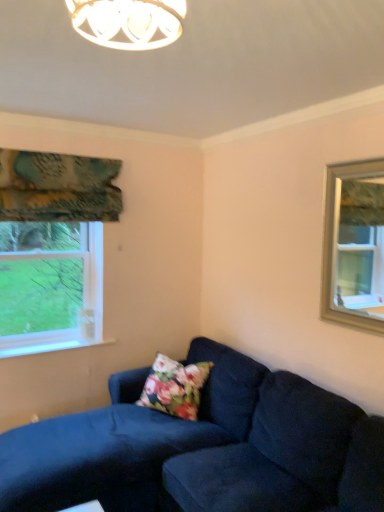
This screenshot has width=384, height=512. What do you see at coordinates (58, 187) in the screenshot?
I see `teal floral fabric at upper left` at bounding box center [58, 187].

Describe the element at coordinates (175, 387) in the screenshot. The image size is (384, 512). I see `floral fabric pillow at lower center` at that location.

Describe the element at coordinates (354, 245) in the screenshot. I see `clear glass window at upper right` at that location.

Identify the location of teal floral fabric at upper left. (58, 187).

Is teal floral fabric at upper left surrounding clear glass window at upper right?

No, teal floral fabric at upper left does not contain clear glass window at upper right.

Is teal floral fabric at upper left facing towards clear glass window at upper right?

No.

Between teal floral fabric at upper left and clear glass window at upper right, which one has larger width?

Wider between the two is teal floral fabric at upper left.

In the scene shown: Is floral fabric pillow at lower center facing away from clear glass window at upper right?

No, clear glass window at upper right is not at the back of floral fabric pillow at lower center.

Is point (159, 381) positioned after point (334, 244)?

That is True.

Between floral fabric pillow at lower center and clear glass window at upper right, which one is positioned in front?

clear glass window at upper right.

Looking at this image, do you think floral fabric pillow at lower center is within clear glass window at upper right, or outside of it?

floral fabric pillow at lower center cannot be found inside clear glass window at upper right.

What's the angular difference between clear glass window at upper right and teal floral fabric at upper left's facing directions?

89.4 degrees separate the facing orientations of clear glass window at upper right and teal floral fabric at upper left.

Considering the sizes of objects clear glass window at upper right and teal floral fabric at upper left in the image provided, who is bigger, clear glass window at upper right or teal floral fabric at upper left?

With larger size is teal floral fabric at upper left.

The image size is (384, 512). Identify the location of curtain to the left of clear glass window at upper right. (58, 187).

From a real-world perspective, is floral fabric pillow at lower center above or below teal floral fabric at upper left?

In terms of real-world spatial position, floral fabric pillow at lower center is below teal floral fabric at upper left.

Considering the sizes of floral fabric pillow at lower center and teal floral fabric at upper left in the image, is floral fabric pillow at lower center bigger or smaller than teal floral fabric at upper left?

Clearly, floral fabric pillow at lower center is larger in size than teal floral fabric at upper left.

Who is taller, floral fabric pillow at lower center or teal floral fabric at upper left?

With more height is floral fabric pillow at lower center.

How different are the orientations of suede dark blue couch at lower right and floral fabric pillow at lower center in degrees?

35.1 degrees.

Relative to floral fabric pillow at lower center, is suede dark blue couch at lower right in front or behind?

In the image, suede dark blue couch at lower right appears in front of floral fabric pillow at lower center.

From a real-world perspective, which is physically below, suede dark blue couch at lower right or floral fabric pillow at lower center?

From a 3D spatial view, suede dark blue couch at lower right is below.

Between point (308, 393) and point (193, 410), which one is positioned behind?

Point (193, 410)

Would you consider teal floral fabric at upper left to be distant from floral fabric pillow at lower center?

Yes, teal floral fabric at upper left is far from floral fabric pillow at lower center.

Is teal floral fabric at upper left turned away from floral fabric pillow at lower center?

No, teal floral fabric at upper left is not facing the opposite direction of floral fabric pillow at lower center.

Based on the photo, between teal floral fabric at upper left and floral fabric pillow at lower center, which one is positioned in front?

Positioned in front is teal floral fabric at upper left.

Is teal floral fabric at upper left at the back of suede dark blue couch at lower right?

No, suede dark blue couch at lower right is not facing away from teal floral fabric at upper left.

Which object is closer to the camera taking this photo, suede dark blue couch at lower right or teal floral fabric at upper left?

Positioned in front is suede dark blue couch at lower right.

Is point (255, 468) closer to camera compared to point (32, 182)?

Yes, point (255, 468) is closer to viewer.

Does suede dark blue couch at lower right have a lesser width compared to teal floral fabric at upper left?

No.

Find the location of a particular element. curtain located above the clear glass window at upper right (from a real-world perspective) is located at coordinates (58, 187).

In order to click on pillow lying on the left of clear glass window at upper right in this screenshot , I will do `click(175, 387)`.

Considering their positions, is clear glass window at upper right positioned further to suede dark blue couch at lower right than teal floral fabric at upper left?

clear glass window at upper right is positioned further to the anchor suede dark blue couch at lower right.

Estimate the real-world distances between objects in this image. Which object is closer to clear glass window at upper right, teal floral fabric at upper left or suede dark blue couch at lower right?

The object closer to clear glass window at upper right is suede dark blue couch at lower right.

Based on the photo, from the image, which object appears to be farther from clear glass window at upper right, suede dark blue couch at lower right or teal floral fabric at upper left?

Based on the image, teal floral fabric at upper left appears to be further to clear glass window at upper right.

Considering their positions, is clear glass window at upper right positioned further to suede dark blue couch at lower right than floral fabric pillow at lower center?

clear glass window at upper right.

From the image, which object appears to be farther from teal floral fabric at upper left, suede dark blue couch at lower right or floral fabric pillow at lower center?

suede dark blue couch at lower right.

Looking at this image, when comparing their distances from floral fabric pillow at lower center, does teal floral fabric at upper left or clear glass window at upper right seem further?

clear glass window at upper right is further to floral fabric pillow at lower center.

Which object lies nearer to the anchor point clear glass window at upper right, floral fabric pillow at lower center or teal floral fabric at upper left?

The object closer to clear glass window at upper right is floral fabric pillow at lower center.

When comparing their distances from suede dark blue couch at lower right, does floral fabric pillow at lower center or teal floral fabric at upper left seem closer?

floral fabric pillow at lower center is closer to suede dark blue couch at lower right.

Identify the location of pillow situated between teal floral fabric at upper left and clear glass window at upper right from left to right. The height and width of the screenshot is (512, 384). (175, 387).

Find the location of `curtain between suede dark blue couch at lower right and floral fabric pillow at lower center from front to back`. curtain between suede dark blue couch at lower right and floral fabric pillow at lower center from front to back is located at coordinates (58, 187).

Where is `window between suede dark blue couch at lower right and teal floral fabric at upper left along the z-axis`? The height and width of the screenshot is (512, 384). window between suede dark blue couch at lower right and teal floral fabric at upper left along the z-axis is located at coordinates (354, 245).

At what (x,y) coordinates should I click in order to perform the action: click on window located between suede dark blue couch at lower right and floral fabric pillow at lower center in the depth direction. Please return your answer as a coordinate pair (x, y). This screenshot has width=384, height=512. Looking at the image, I should click on (354, 245).